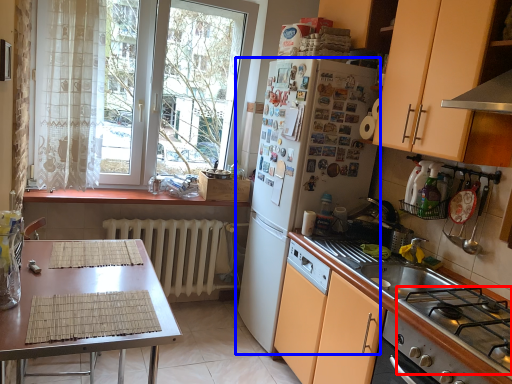
Question: Which object is further to the camera taking this photo, gas stove (highlighted by a red box) or refrigerator (highlighted by a blue box)?

Choices:
 (A) gas stove
 (B) refrigerator

Answer: (B)